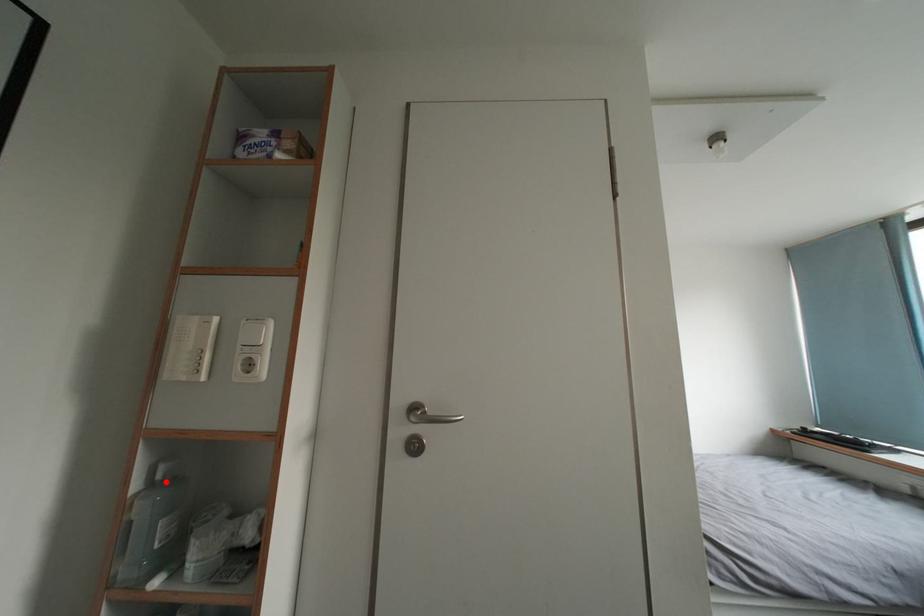
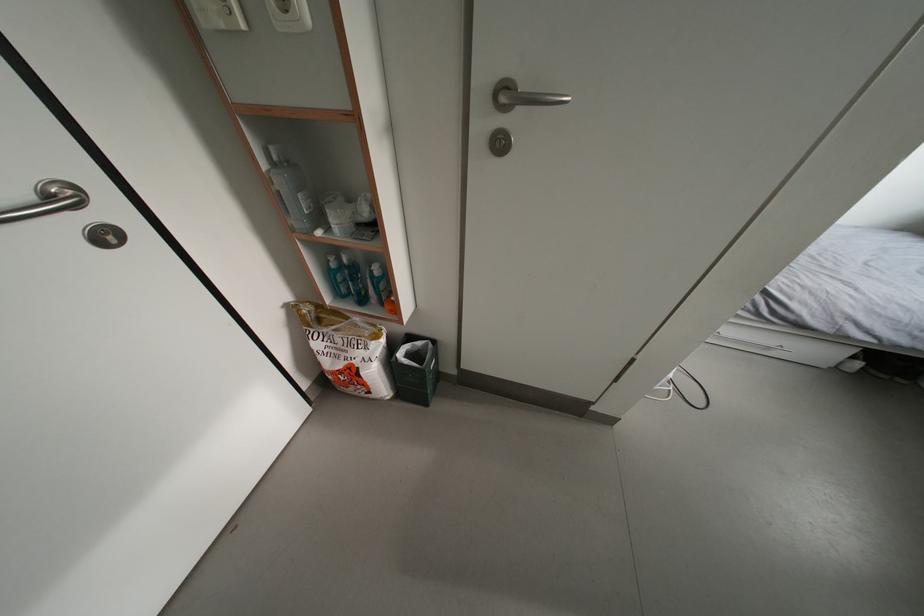
Find the pixel in the second image that matches the highlighted location in the first image.

(283, 163)